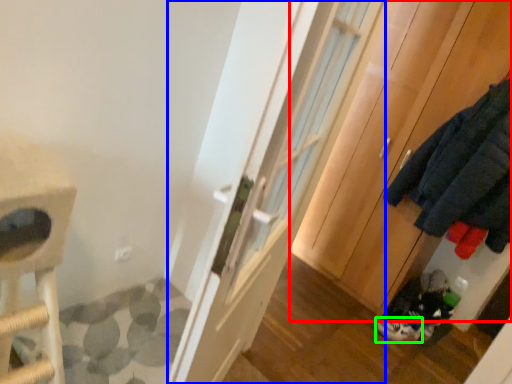
Question: Estimate the real-world distances between objects in this image. Which object is farther from cabinetry (highlighted by a red box), door (highlighted by a blue box) or footwear (highlighted by a green box)?

Choices:
 (A) door
 (B) footwear

Answer: (A)